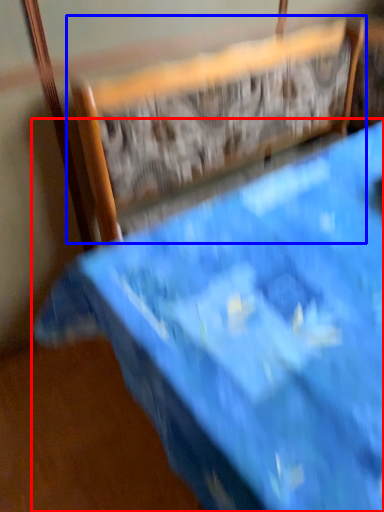
Question: Which of the following is the closest to the observer, furniture (highlighted by a red box) or chair (highlighted by a blue box)?

Choices:
 (A) furniture
 (B) chair

Answer: (A)